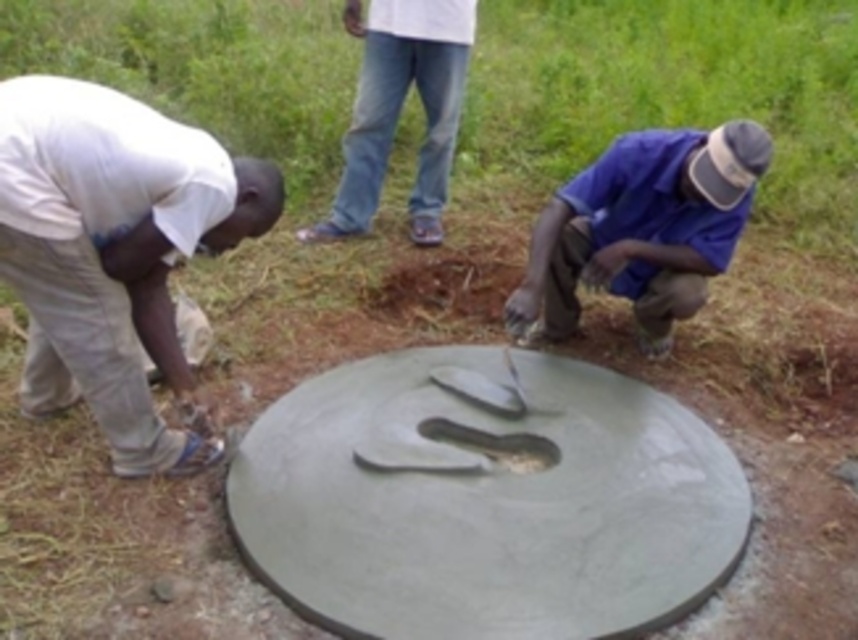
Question: Does white denim jeans at upper center have a smaller size compared to green concrete manhole at center?

Choices:
 (A) yes
 (B) no

Answer: (B)

Question: Among these points, which one is nearest to the camera?

Choices:
 (A) (366, 285)
 (B) (396, 58)
 (C) (625, 189)
 (D) (0, 256)

Answer: (D)

Question: Which point is closer to the camera?

Choices:
 (A) (656, 426)
 (B) (412, 278)
 (C) (560, 328)

Answer: (A)

Question: Which of the following is the closest to the observer?

Choices:
 (A) coord(61,124)
 (B) coord(511,269)
 (C) coord(352,132)
 (D) coord(716,529)

Answer: (A)

Question: Does gray concrete manhole at center have a larger size compared to green concrete manhole at center?

Choices:
 (A) no
 (B) yes

Answer: (B)

Question: Observing the image, what is the correct spatial positioning of blue matte shirt at right in reference to green concrete manhole at center?

Choices:
 (A) right
 (B) left

Answer: (A)